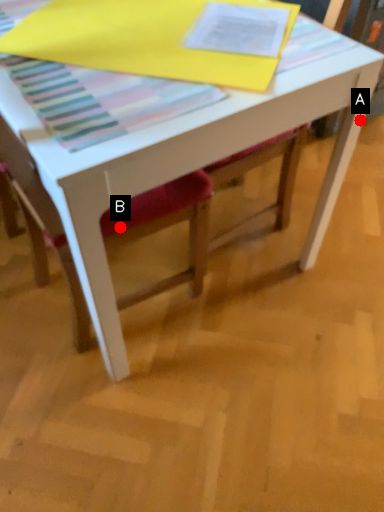
Question: Two points are circled on the image, labeled by A and B beside each circle. Which point is farther to the camera?

Choices:
 (A) A is further
 (B) B is further

Answer: (A)